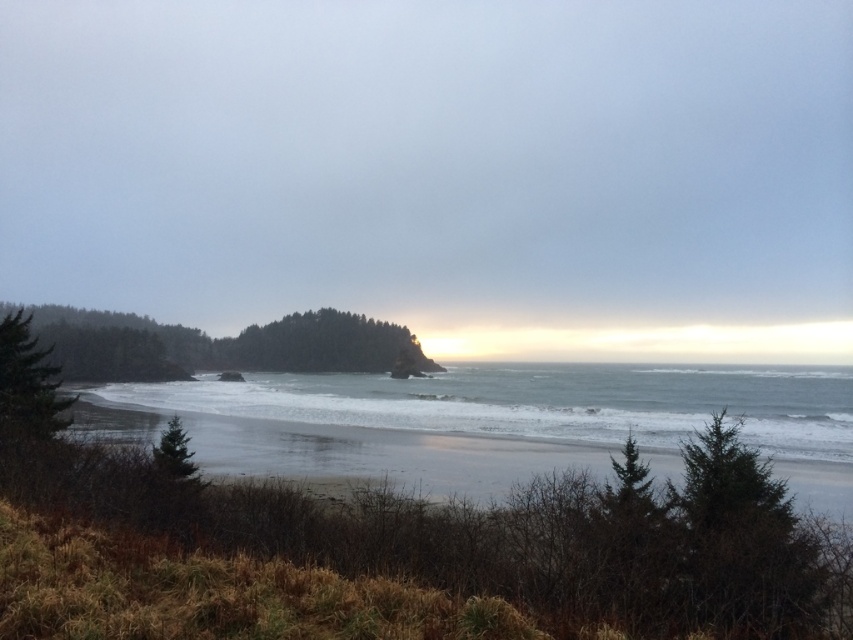
Which is behind, point (740, 557) or point (6, 353)?

The point (6, 353) is behind.

Is point (700, 550) farther from viewer compared to point (41, 428)?

No, it is in front of (41, 428).

The height and width of the screenshot is (640, 853). What are the coordinates of `green textured tree at lower right` in the screenshot? It's located at (741, 540).

Based on the photo, does grayish-blue water at center lie in front of green matte tree at center?

That is True.

Does grayish-blue water at center have a smaller size compared to green matte tree at center?

No, grayish-blue water at center is not smaller than green matte tree at center.

Identify the location of grayish-blue water at center. This screenshot has width=853, height=640. (492, 422).

Is grayish-blue water at center to the right of green matte tree at left from the viewer's perspective?

Indeed, grayish-blue water at center is positioned on the right side of green matte tree at left.

What do you see at coordinates (492, 422) in the screenshot? Image resolution: width=853 pixels, height=640 pixels. I see `grayish-blue water at center` at bounding box center [492, 422].

Between point (254, 435) and point (57, 371), which one is positioned behind?

The point (254, 435) is more distant.

At what (x,y) coordinates should I click in order to perform the action: click on grayish-blue water at center. Please return your answer as a coordinate pair (x, y). The image size is (853, 640). Looking at the image, I should click on (492, 422).